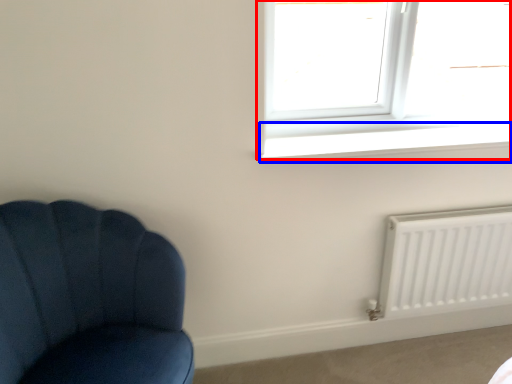
Question: Which of the following is the closest to the observer, window (highlighted by a red box) or window sill (highlighted by a blue box)?

Choices:
 (A) window
 (B) window sill

Answer: (B)